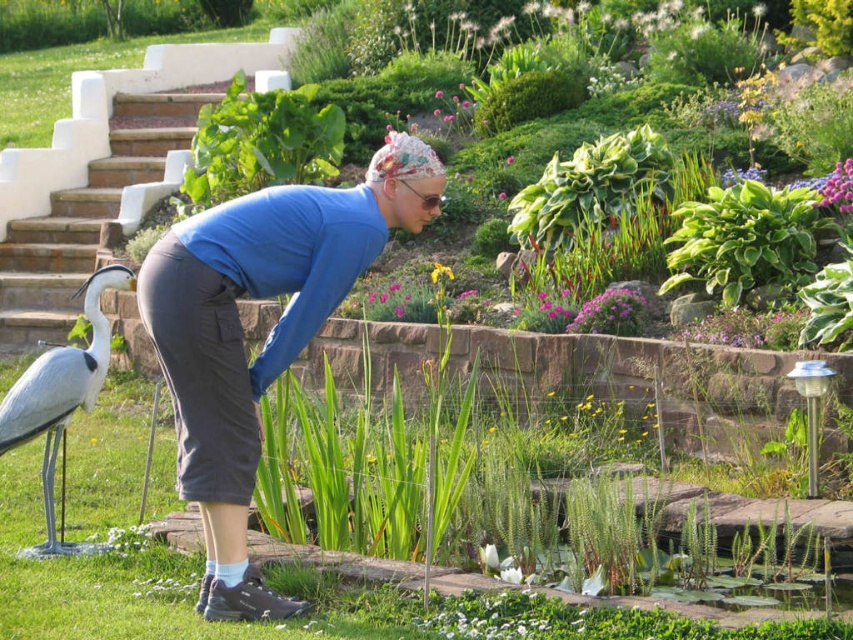
Is blue fabric at center below white matte bird at lower left?

Actually, blue fabric at center is above white matte bird at lower left.

Between blue fabric at center and white matte bird at lower left, which one is positioned lower?

white matte bird at lower left

At what (x,y) coordinates should I click in order to perform the action: click on blue fabric at center. Please return your answer as a coordinate pair (x, y). Looking at the image, I should click on (265, 337).